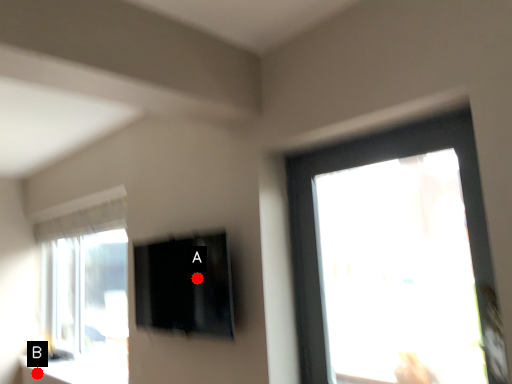
Question: Two points are circled on the image, labeled by A and B beside each circle. Which of the following is the farthest from the observer?

Choices:
 (A) A is further
 (B) B is further

Answer: (B)